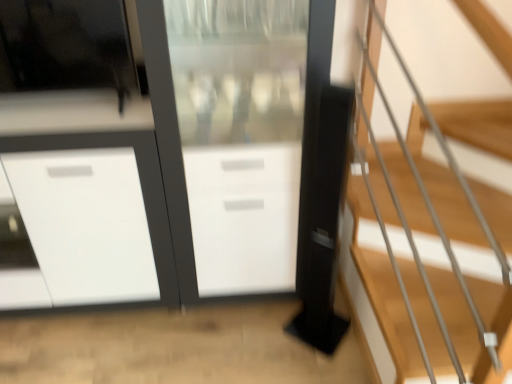
Question: From a real-world perspective, does white glossy cabinet at center sit lower than wooden stairs at right?

Choices:
 (A) no
 (B) yes

Answer: (B)

Question: From the image's perspective, is white glossy cabinet at center under wooden stairs at right?

Choices:
 (A) no
 (B) yes

Answer: (B)

Question: From the image's perspective, does white glossy cabinet at center appear higher than wooden stairs at right?

Choices:
 (A) no
 (B) yes

Answer: (A)

Question: From a real-world perspective, is white glossy cabinet at center on wooden stairs at right?

Choices:
 (A) no
 (B) yes

Answer: (A)

Question: Is white glossy cabinet at center placed right next to wooden stairs at right?

Choices:
 (A) yes
 (B) no

Answer: (B)

Question: Does white glossy cabinet at center come in front of wooden stairs at right?

Choices:
 (A) no
 (B) yes

Answer: (A)

Question: Could you tell me if transparent glass screen door at center is turned towards white glossy cabinet at center?

Choices:
 (A) no
 (B) yes

Answer: (A)

Question: From the image's perspective, is transparent glass screen door at center on top of white glossy cabinet at center?

Choices:
 (A) yes
 (B) no

Answer: (A)

Question: From a real-world perspective, is transparent glass screen door at center on white glossy cabinet at center?

Choices:
 (A) yes
 (B) no

Answer: (A)

Question: Could white glossy cabinet at center be considered to be inside transparent glass screen door at center?

Choices:
 (A) yes
 (B) no

Answer: (B)

Question: Is transparent glass screen door at center completely or partially outside of white glossy cabinet at center?

Choices:
 (A) no
 (B) yes

Answer: (B)

Question: Considering the relative sizes of transparent glass screen door at center and white glossy cabinet at center in the image provided, is transparent glass screen door at center thinner than white glossy cabinet at center?

Choices:
 (A) no
 (B) yes

Answer: (B)

Question: Could you tell me if wooden stairs at right is turned towards transparent glass screen door at center?

Choices:
 (A) yes
 (B) no

Answer: (B)